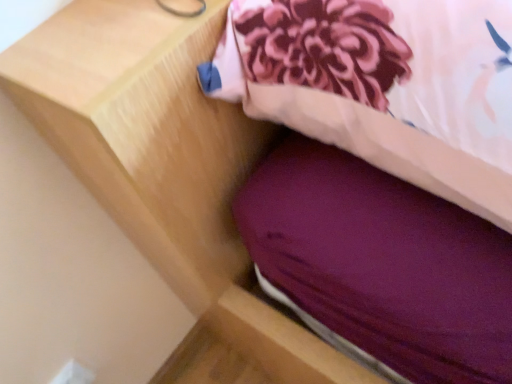
Image resolution: width=512 pixels, height=384 pixels. What do you see at coordinates (383, 86) in the screenshot? I see `matte purple pillow at upper right` at bounding box center [383, 86].

You are a GUI agent. You are given a task and a screenshot of the screen. Output one action in this format:
    pyautogui.click(x=<x>, y=<y>)
    Task: Click on the matte purple pillow at upper right
    This screenshot has height=384, width=512.
    Given the screenshot: What is the action you would take?
    pyautogui.click(x=383, y=86)

You are a GUI agent. You are given a task and a screenshot of the screen. Output one action in this format:
    pyautogui.click(x=<x>, y=<y>)
    Task: Click on the matte purple pillow at upper right
    The image size is (512, 384).
    Given the screenshot: What is the action you would take?
    pyautogui.click(x=383, y=86)